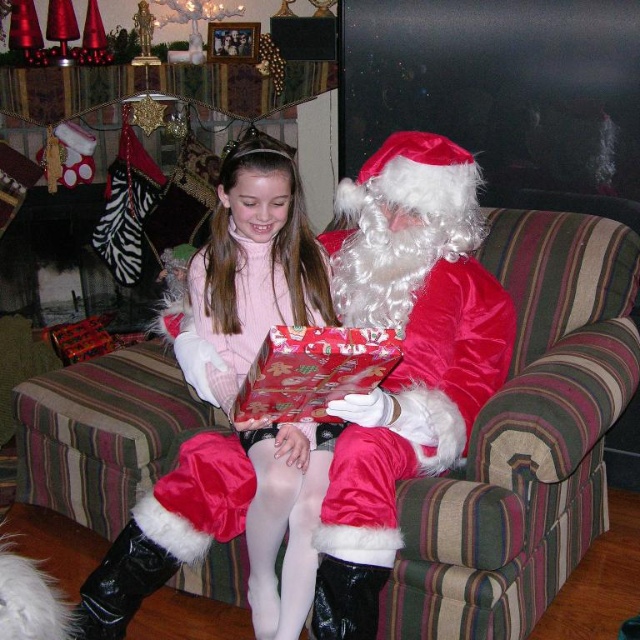
You are a guest entering the living room and want to sit on the striped fabric couch at center. However, you notice the shiny red wrapping paper at center above it. Is there enough space to sit comfortably without the wrapping paper touching your head?

The striped fabric couch at center is positioned under the shiny red wrapping paper at center, so there may not be enough vertical space between them for someone to sit comfortably without the wrapping paper touching their head. It might be better to choose another seat.

You are a guest at the Christmas party and want to take a photo with the satin santa at center and the shiny red wrapping paper at center. Where should you stand to ensure both are in the frame?

You should stand in a position where the satin santa at center is below the shiny red wrapping paper at center, ensuring both are visible in the photo.

You are a delivery robot with a width of 1.5 meters. You need to move from the entrance to the living room to the fireplace where the stockings are hung. There is an obstacle at point (x=486, y=544). Can you navigate around it safely?

The obstacle at point (x=486, y=544) is 1.59 meters away from you. Since your width is 1.5 meters, you can navigate around it safely as the distance is sufficient to avoid collision.